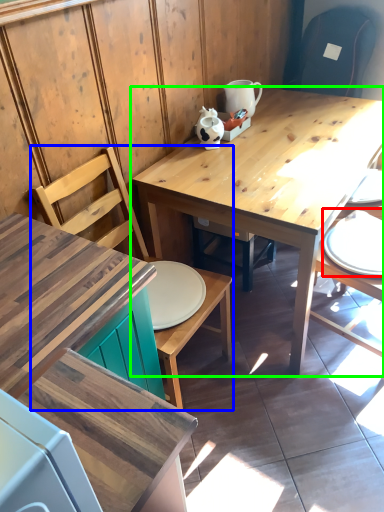
Question: Estimate the real-world distances between objects in this image. Which object is farther from tableware (highlighted by a red box), chair (highlighted by a blue box) or table (highlighted by a green box)?

Choices:
 (A) chair
 (B) table

Answer: (A)